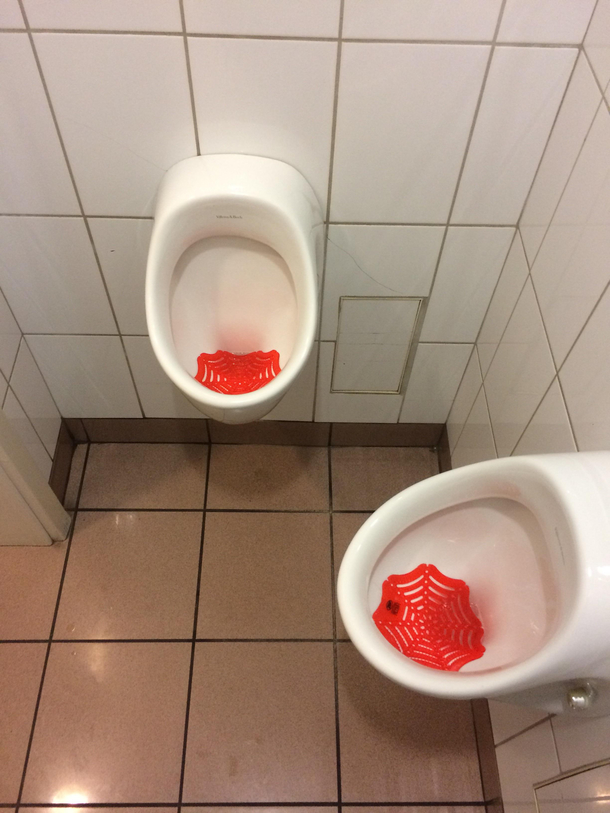
You are a GUI agent. You are given a task and a screenshot of the screen. Output one action in this format:
    pyautogui.click(x=<x>, y=<y>)
    Task: Click on the access panel
    The width and height of the screenshot is (610, 813).
    Given the screenshot: What is the action you would take?
    pyautogui.click(x=379, y=328), pyautogui.click(x=579, y=792)